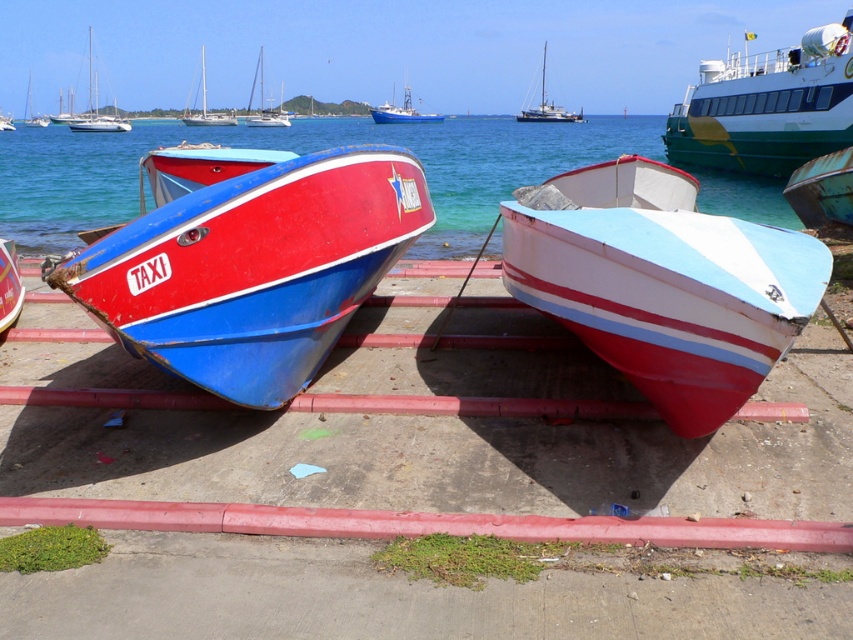
Question: Is white matte boat at center below green glossy ferry at upper right?

Choices:
 (A) no
 (B) yes

Answer: (B)

Question: Which is nearer to the blue glossy boat at center?

Choices:
 (A) green glossy ferry at upper right
 (B) red matte taxi boat at left

Answer: (B)

Question: Is clear blue water at center bigger than rusty metal boat at right?

Choices:
 (A) no
 (B) yes

Answer: (B)

Question: Can you confirm if white matte boat at center is smaller than rusty metal boat at right?

Choices:
 (A) no
 (B) yes

Answer: (A)

Question: Among these objects, which one is farthest from the camera?

Choices:
 (A) white matte boat at center
 (B) smooth concrete dock at center
 (C) green glossy ferry at upper right

Answer: (C)

Question: Which point is farther from the camera taking this photo?

Choices:
 (A) (773, 92)
 (B) (461, 186)
 (C) (263, 122)
 (D) (9, 276)

Answer: (C)